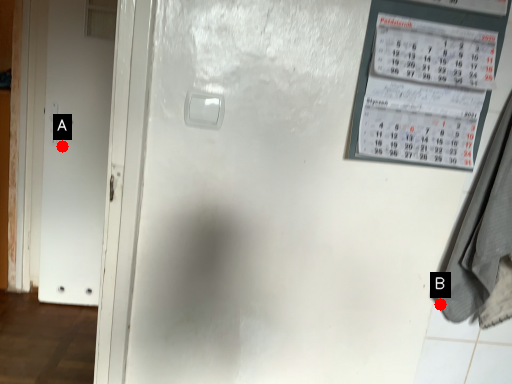
Question: Two points are circled on the image, labeled by A and B beside each circle. Which point is closer to the camera?

Choices:
 (A) A is closer
 (B) B is closer

Answer: (B)